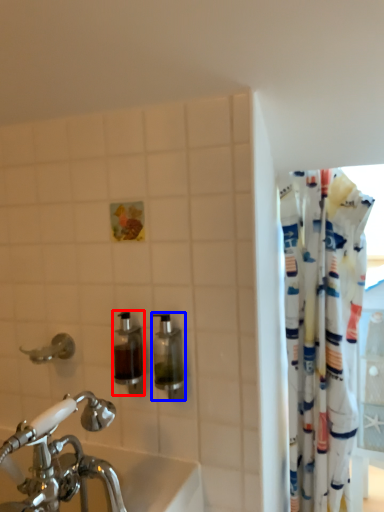
Question: Which point is further to the camera, soap dispenser (highlighted by a red box) or soap dispenser (highlighted by a blue box)?

Choices:
 (A) soap dispenser
 (B) soap dispenser

Answer: (A)